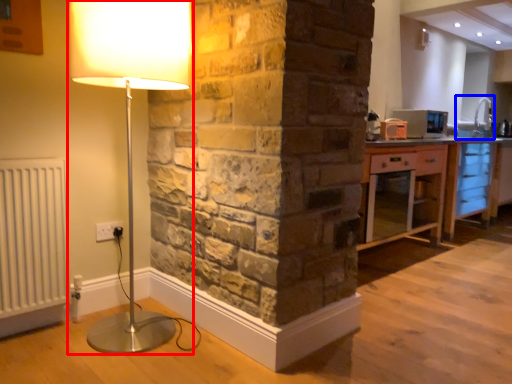
Question: Which object appears closest to the camera in this image, lamp (highlighted by a red box) or sink (highlighted by a blue box)?

Choices:
 (A) lamp
 (B) sink

Answer: (A)